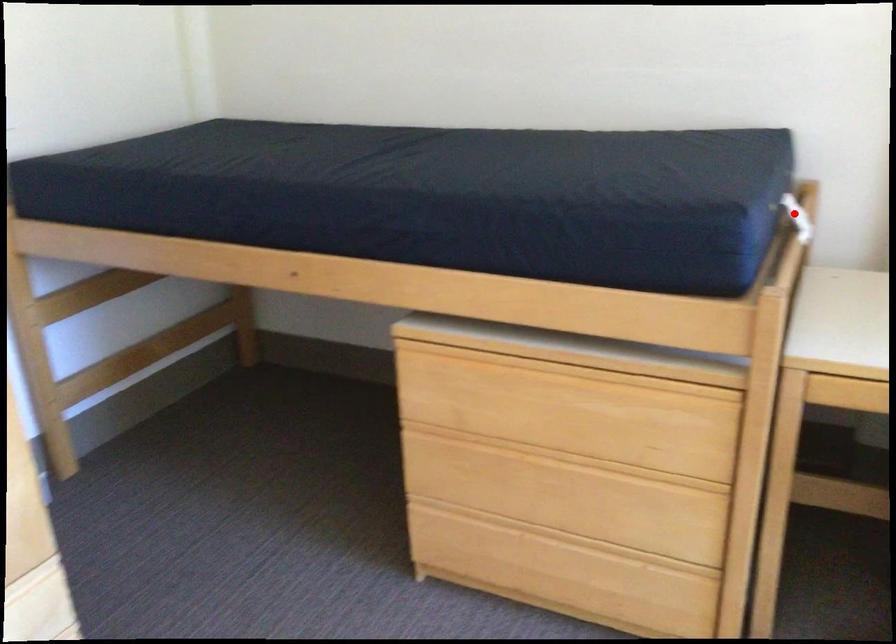
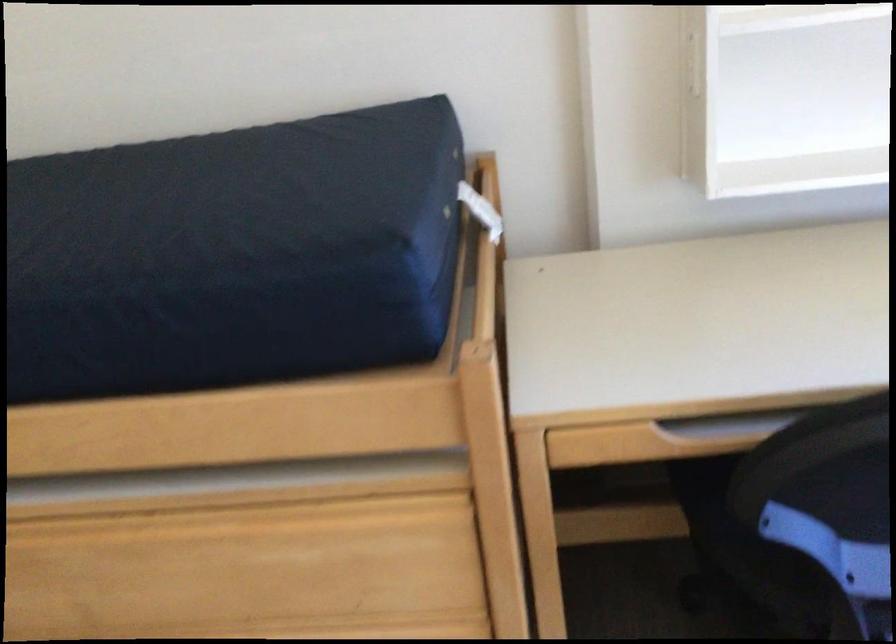
In the second image, find the point that corresponds to the highlighted location in the first image.

(480, 211)